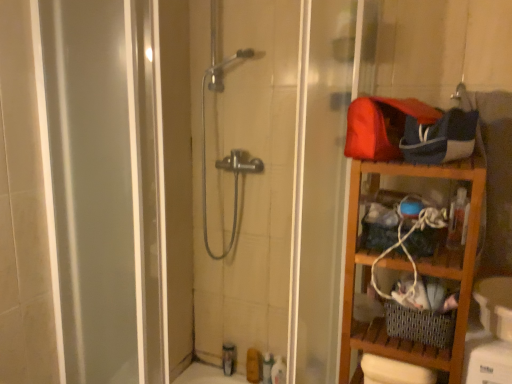
Question: Considering the positions of wooden shelf at right and matte brown soap at lower center, arranged as the 3th toiletry when viewed from the right, in the image, is wooden shelf at right bigger or smaller than matte brown soap at lower center, arranged as the 3th toiletry when viewed from the right,?

Choices:
 (A) big
 (B) small

Answer: (A)

Question: From a real-world perspective, is wooden shelf at right physically located above or below matte brown soap at lower center, arranged as the 3th toiletry when viewed from the right?

Choices:
 (A) below
 (B) above

Answer: (B)

Question: Estimate the real-world distances between objects in this image. Which object is closer to the translucent plastic toiletries at lower center, placed as the fourth toiletry when sorted from right to left?

Choices:
 (A) matte brown soap at lower center, arranged as the 3th toiletry when viewed from the right
 (B) wooden shelf at right
 (C) translucent plastic bottle at lower center, marked as the 2th toiletry in a right-to-left arrangement
 (D) white glossy bottle at lower center, which is the 1th toiletry from right to left

Answer: (A)

Question: Which object is positioned farthest from the translucent plastic bottle at lower center, the third toiletry positioned from the left?

Choices:
 (A) wooden shelf at right
 (B) translucent plastic toiletries at lower center, which is counted as the 1th toiletry, starting from the left
 (C) white glossy bottle at lower center, which is the 1th toiletry from right to left
 (D) matte brown soap at lower center, which is counted as the 2th toiletry, starting from the left

Answer: (A)